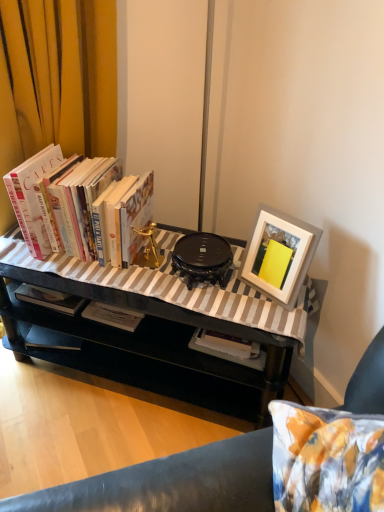
The height and width of the screenshot is (512, 384). Identify the location of vacant area to the left of white matte picture frame at upper right. (230, 301).